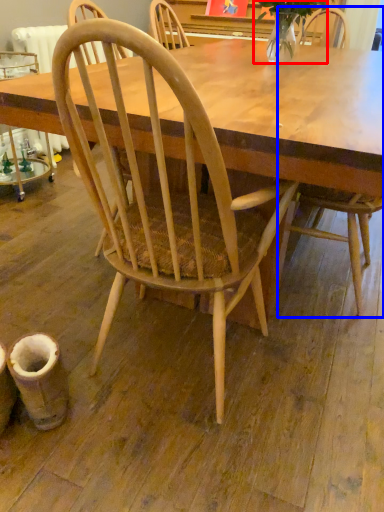
Question: Which object is closer to the camera taking this photo, plant (highlighted by a red box) or chair (highlighted by a blue box)?

Choices:
 (A) plant
 (B) chair

Answer: (B)